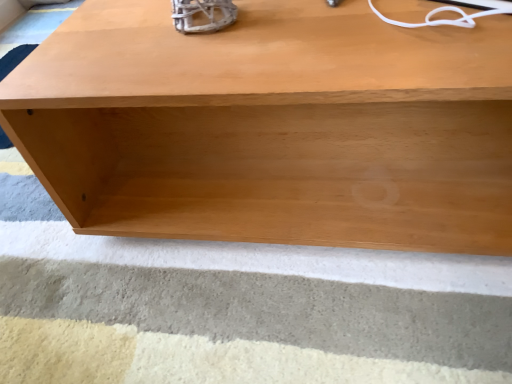
Where is `light wood table at center`? The width and height of the screenshot is (512, 384). light wood table at center is located at coordinates (272, 127).

What is the approximate height of light wood table at center?

12.86 inches.

The width and height of the screenshot is (512, 384). What do you see at coordinates (272, 127) in the screenshot?
I see `light wood table at center` at bounding box center [272, 127].

You are a GUI agent. You are given a task and a screenshot of the screen. Output one action in this format:
    pyautogui.click(x=<x>, y=<y>)
    Task: Click on the light wood table at center
    The width and height of the screenshot is (512, 384).
    Given the screenshot: What is the action you would take?
    pyautogui.click(x=272, y=127)